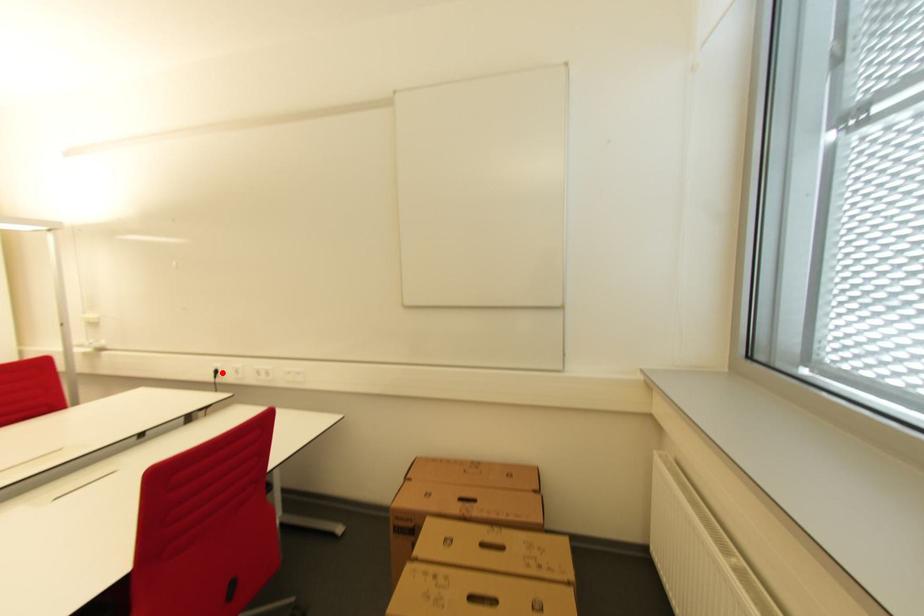
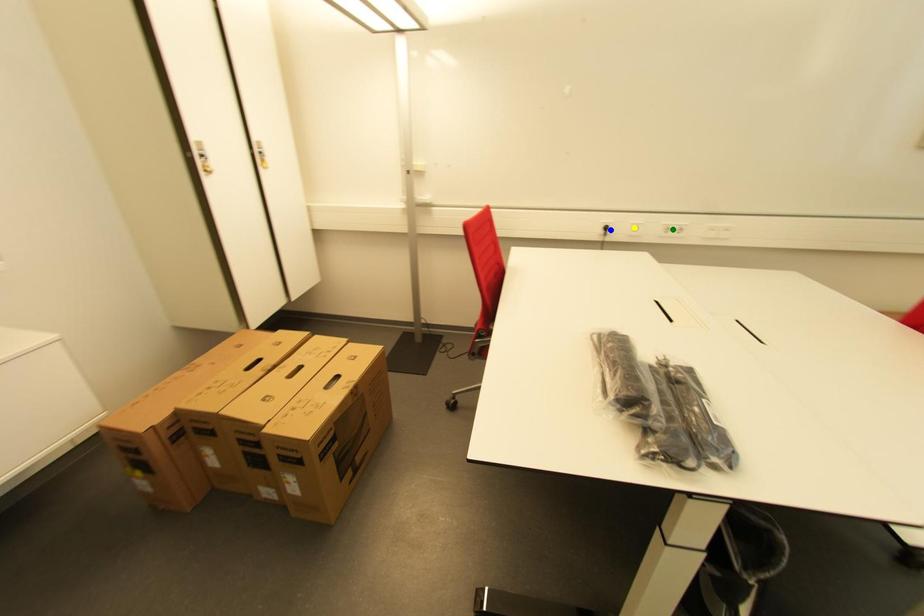
Question: I am providing you with two images of the same scene from different viewpoints. A red point is marked on the first image. You are given multiple points on the second image. Which mark in image 2 goes with the point in image 1?

Choices:
 (A) yellow point
 (B) green point
 (C) blue point

Answer: (C)